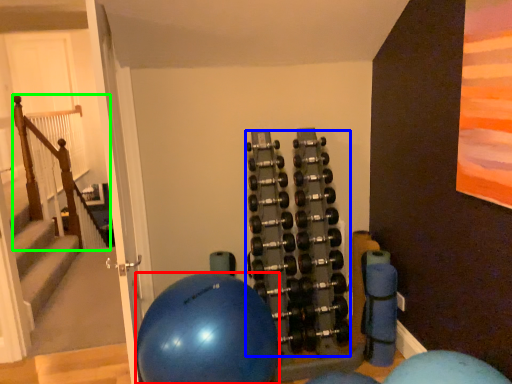
Question: Which object is the closest to the ball (highlighted by a red box)? Choose among these: dumbbell (highlighted by a blue box) or rail (highlighted by a green box).

Choices:
 (A) dumbbell
 (B) rail

Answer: (A)